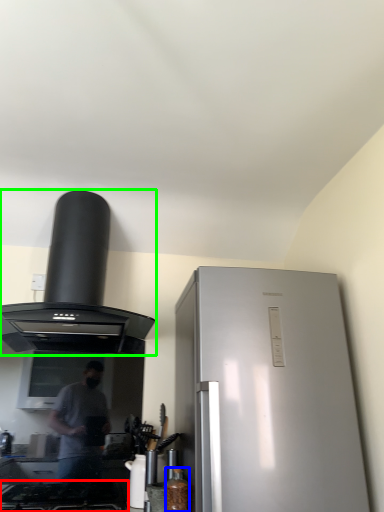
Question: Which is nearer to the gas stove (highlighted by a red box)? bottle (highlighted by a blue box) or kitchen appliance (highlighted by a green box).

Choices:
 (A) bottle
 (B) kitchen appliance

Answer: (A)